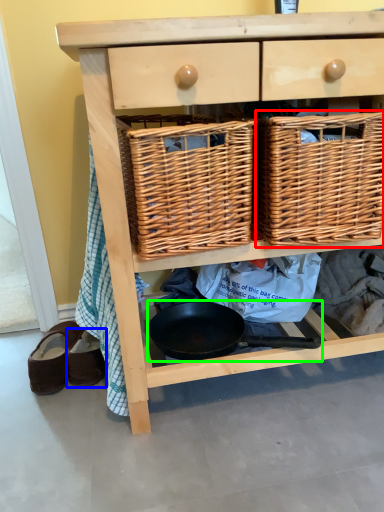
Question: Based on their relative distances, which object is nearer to picnic basket (highlighted by a red box)? Choose from footwear (highlighted by a blue box) and frying pan (highlighted by a green box).

Choices:
 (A) footwear
 (B) frying pan

Answer: (B)